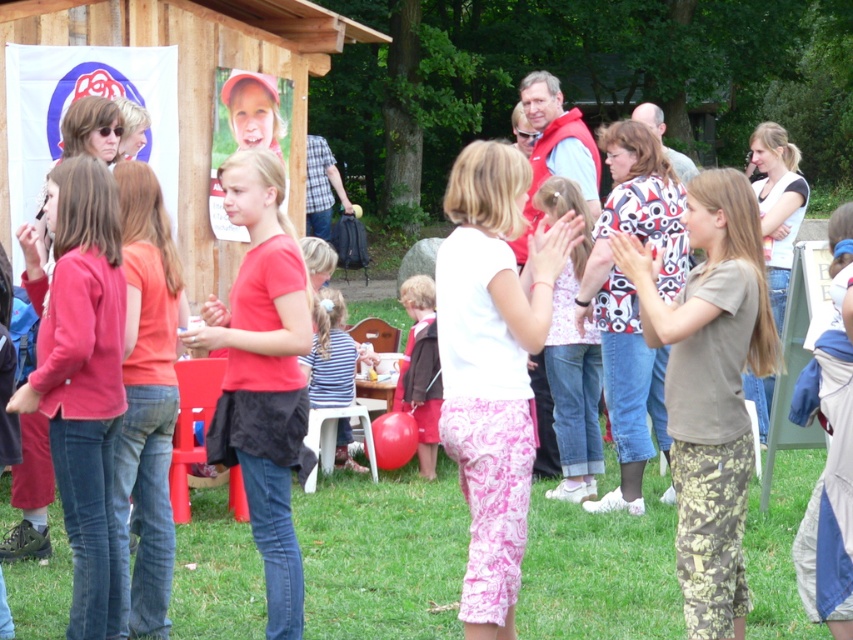
Question: Which point appears closest to the camera in this image?

Choices:
 (A) (503, 312)
 (B) (790, 525)
 (C) (260, 376)

Answer: (A)

Question: Does green grass at center appear over matte red jacket at left?

Choices:
 (A) no
 (B) yes

Answer: (A)

Question: Which object is positioned closest to the matte red shirt at center?

Choices:
 (A) brown fabric jacket at center
 (B) green grass at center
 (C) brown cotton shirt at center

Answer: (B)

Question: Does brown cotton shirt at center have a lesser width compared to matte red shirt at center?

Choices:
 (A) yes
 (B) no

Answer: (B)

Question: Is green grass at center wider than brown fabric jacket at center?

Choices:
 (A) no
 (B) yes

Answer: (B)

Question: Which object appears closest to the camera in this image?

Choices:
 (A) white cotton shirt at center
 (B) matte red shirt at center
 (C) brown cotton shirt at center
 (D) brown fabric jacket at center

Answer: (A)